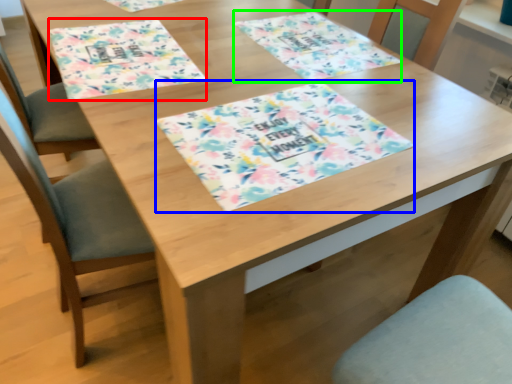
Question: Estimate the real-world distances between objects in this image. Which object is farther from place mat (highlighted by a red box), tablecloth (highlighted by a blue box) or place mat (highlighted by a green box)?

Choices:
 (A) tablecloth
 (B) place mat

Answer: (B)